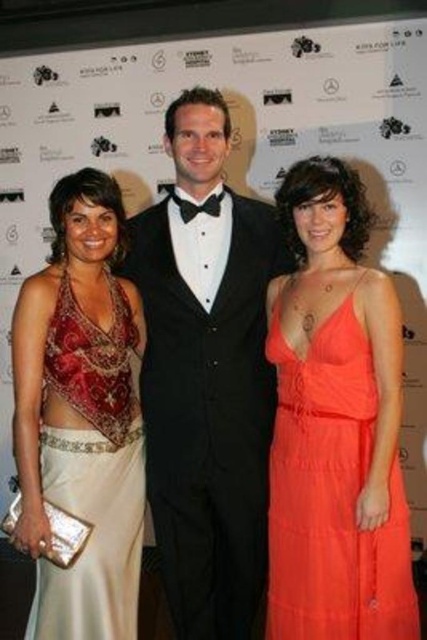
Question: Based on their relative distances, which object is nearer to the black satin tuxedo at center?

Choices:
 (A) orange chiffon dress at center
 (B) satin gold dress at left

Answer: (B)

Question: Does black satin tuxedo at center have a larger size compared to satin gold dress at left?

Choices:
 (A) no
 (B) yes

Answer: (B)

Question: Does black satin tuxedo at center have a greater width compared to orange chiffon dress at center?

Choices:
 (A) yes
 (B) no

Answer: (A)

Question: Which of the following is the closest to the observer?

Choices:
 (A) (388, 289)
 (B) (198, 352)
 (C) (99, 461)

Answer: (A)

Question: Considering the real-world distances, which object is closest to the orange chiffon dress at center?

Choices:
 (A) satin gold dress at left
 (B) black satin tuxedo at center

Answer: (B)

Question: Does orange chiffon dress at center have a greater width compared to satin gold dress at left?

Choices:
 (A) yes
 (B) no

Answer: (A)